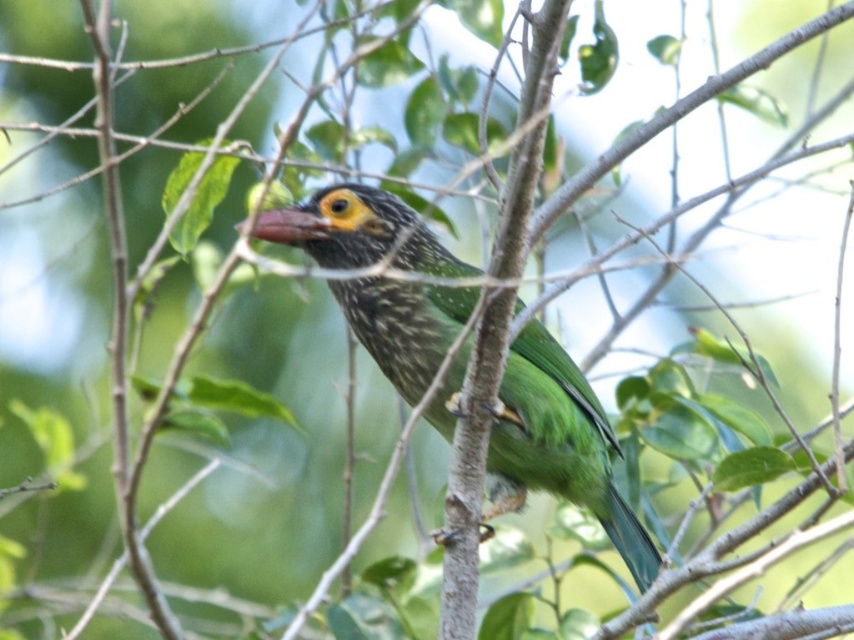
Question: Does green glossy bird at center have a lesser width compared to smooth red beak at center?

Choices:
 (A) no
 (B) yes

Answer: (A)

Question: Is green glossy bird at center smaller than smooth red beak at center?

Choices:
 (A) no
 (B) yes

Answer: (A)

Question: Which of the following is the closest to the observer?

Choices:
 (A) (642, 557)
 (B) (268, 225)

Answer: (B)

Question: Which object is closer to the camera taking this photo?

Choices:
 (A) green glossy bird at center
 (B) smooth red beak at center

Answer: (B)

Question: Which object appears farthest from the camera in this image?

Choices:
 (A) green glossy bird at center
 (B) smooth red beak at center

Answer: (A)

Question: Is green glossy bird at center to the left of smooth red beak at center from the viewer's perspective?

Choices:
 (A) no
 (B) yes

Answer: (A)